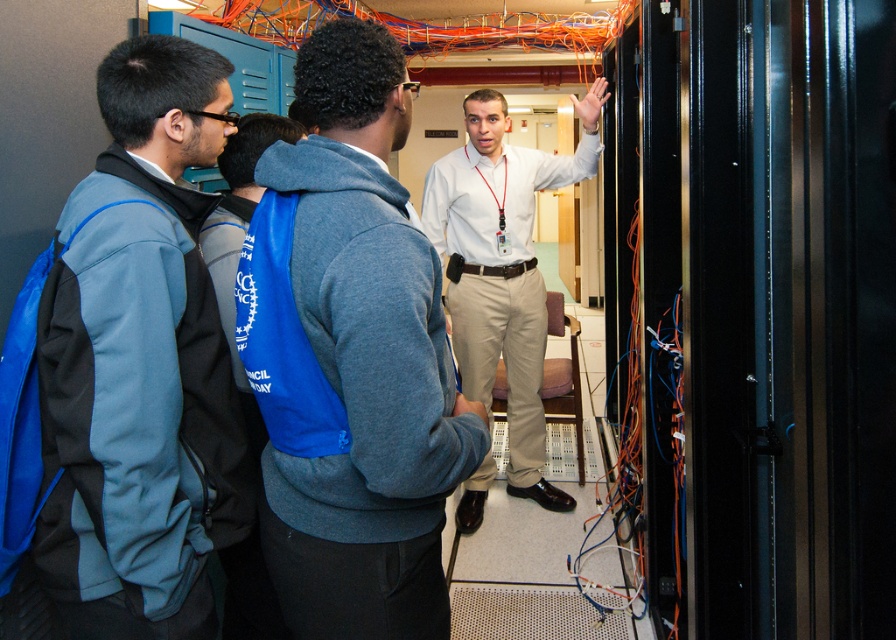
Question: Which point is farther from the camera taking this photo?

Choices:
 (A) (321, 480)
 (B) (62, 364)

Answer: (A)

Question: Is blue fleece jacket at left to the right of gray hoodie at center from the viewer's perspective?

Choices:
 (A) no
 (B) yes

Answer: (A)

Question: Can you confirm if blue fleece jacket at left is positioned above gray hoodie at center?

Choices:
 (A) yes
 (B) no

Answer: (A)

Question: Does blue fleece jacket at left have a greater width compared to white shirt at center?

Choices:
 (A) no
 (B) yes

Answer: (A)

Question: Which object is the farthest from the blue fleece jacket at left?

Choices:
 (A) gray hoodie at center
 (B) white shirt at center

Answer: (B)

Question: Among these points, which one is nearest to the camera?

Choices:
 (A) (378, 497)
 (B) (524, 176)

Answer: (A)